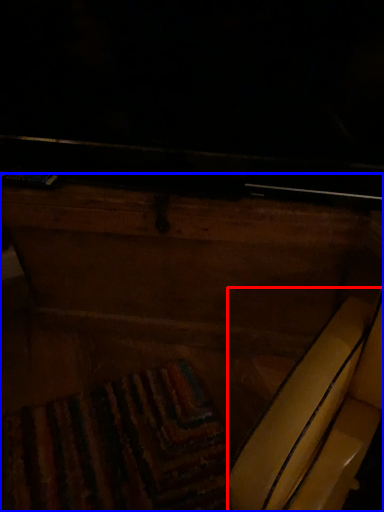
Question: Which object appears farthest to the camera in this image, swivel chair (highlighted by a red box) or furniture (highlighted by a blue box)?

Choices:
 (A) swivel chair
 (B) furniture

Answer: (B)